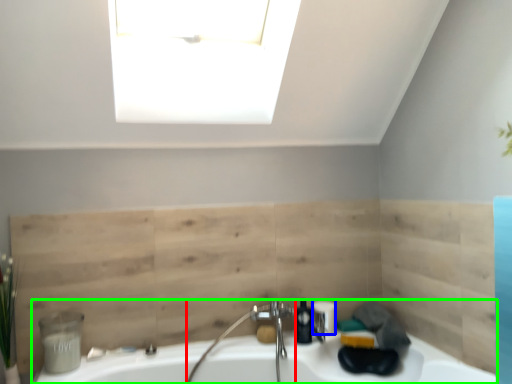
Question: Which object is positioned farthest from faucet (highlighted by a red box)? Select from toiletry (highlighted by a blue box) and sink (highlighted by a green box).

Choices:
 (A) toiletry
 (B) sink

Answer: (A)